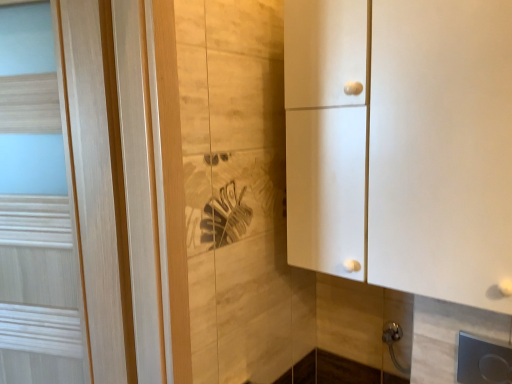
Question: Is white matte cabinet at right bigger or smaller than metallic silver door handle at lower right?

Choices:
 (A) big
 (B) small

Answer: (A)

Question: In the image, is white matte cabinet at right positioned in front of or behind metallic silver door handle at lower right?

Choices:
 (A) behind
 (B) front

Answer: (B)

Question: Estimate the real-world distances between objects in this image. Which object is farther from the light wood door at left?

Choices:
 (A) white matte cabinet at right
 (B) metallic silver door handle at lower right

Answer: (B)

Question: Which is farther from the light wood door at left?

Choices:
 (A) white matte cabinet at right
 (B) metallic silver door handle at lower right

Answer: (B)